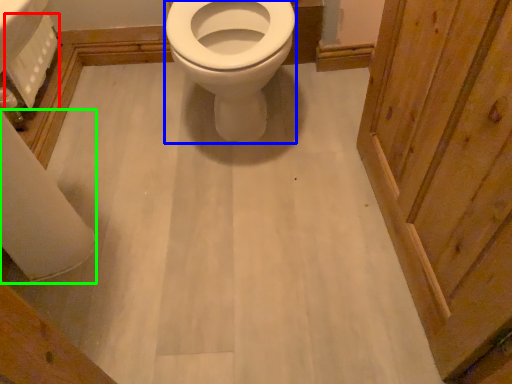
Question: Estimate the real-world distances between objects in this image. Which object is farther from toilet paper (highlighted by a red box), bidet (highlighted by a blue box) or toilet paper (highlighted by a green box)?

Choices:
 (A) bidet
 (B) toilet paper

Answer: (A)